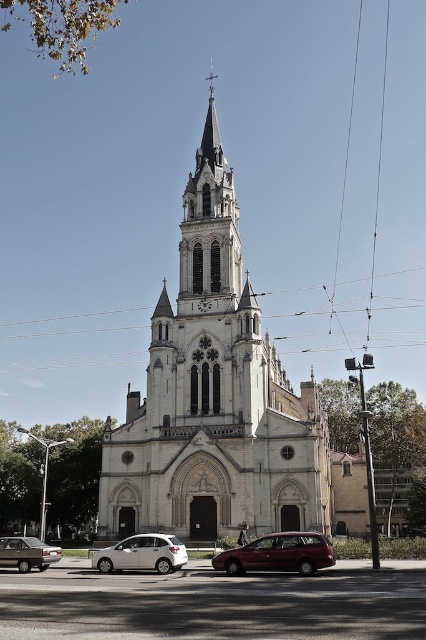
Which of these two, white stone church at center or matte silver sedan at lower left, stands shorter?

With less height is matte silver sedan at lower left.

Does white stone church at center have a larger size compared to matte silver sedan at lower left?

Indeed, white stone church at center has a larger size compared to matte silver sedan at lower left.

Where is `white stone church at center`? This screenshot has height=640, width=426. white stone church at center is located at coordinates (213, 396).

Between point (258, 540) and point (39, 570), which one is positioned behind?

Positioned behind is point (39, 570).

Who is shorter, metallic red minivan at lower center or matte silver sedan at lower left?

metallic red minivan at lower center

Where is `metallic red minivan at lower center`? metallic red minivan at lower center is located at coordinates (278, 554).

Between white stone church at center and metallic red minivan at lower center, which one has less height?

metallic red minivan at lower center

Does white stone church at center appear on the right side of metallic red minivan at lower center?

No, white stone church at center is not to the right of metallic red minivan at lower center.

Locate an element on the screen. This screenshot has width=426, height=640. white stone church at center is located at coordinates (213, 396).